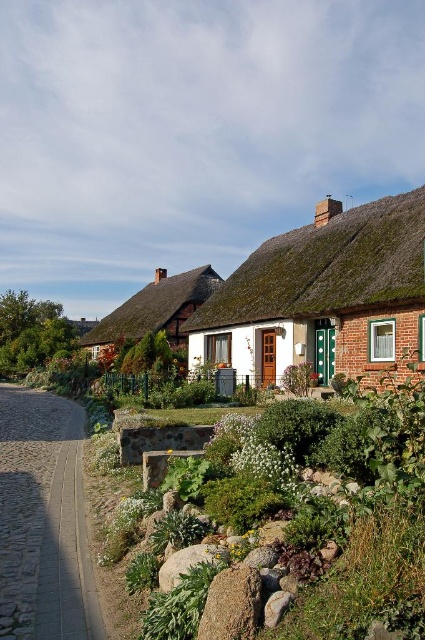
You are standing in a rural area and see the thatched roof at upper center. If you want to reach it within 10 seconds, what is the minimum speed you need to walk at in feet per second?

The thatched roof at upper center is 63.44 feet away from viewer. To reach it within 10 seconds, you need to walk at a minimum speed of 6.344 feet per second.

You are standing at the point with coordinates point (98, 339) and want to walk towards the point with coordinates point (261, 301). Which direction should you face to walk directly towards your destination?

You should face north to walk directly towards point (261, 301) from point (98, 339) because the destination is located north of your current position.